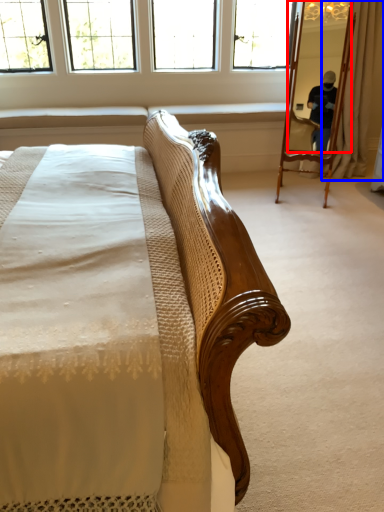
Question: Which of the following is the farthest to the observer, mirror (highlighted by a red box) or curtain (highlighted by a blue box)?

Choices:
 (A) mirror
 (B) curtain

Answer: (B)